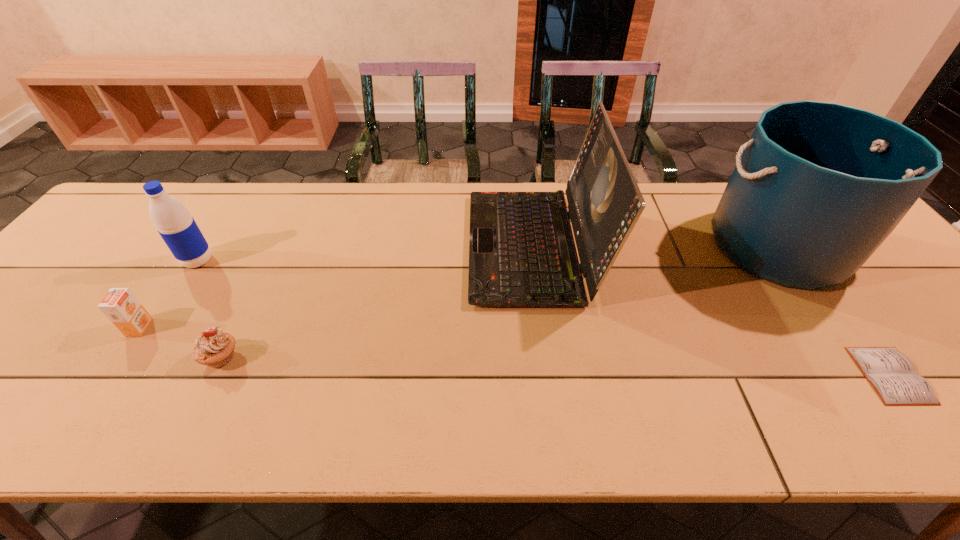
The width and height of the screenshot is (960, 540). Find the location of `free space located 0.130m on the screen of the laptop computer`. free space located 0.130m on the screen of the laptop computer is located at coordinates (422, 246).

The image size is (960, 540). What are the coordinates of `free space located on the screen of the laptop computer` in the screenshot? It's located at (419, 246).

Locate an element on the screen. This screenshot has height=540, width=960. free space located 0.250m on the right of the fourth shortest object is located at coordinates (307, 261).

This screenshot has width=960, height=540. In order to click on free region located 0.260m on the right of the fourth farthest object in this screenshot , I will do `click(260, 328)`.

Identify the location of free space located on the front of the second shortest object. (191, 418).

You are a GUI agent. You are given a task and a screenshot of the screen. Output one action in this format:
    pyautogui.click(x=<x>, y=<y>)
    Task: Click on the free region located 0.070m on the right of the diary
    The image size is (960, 540).
    Given the screenshot: What is the action you would take?
    pyautogui.click(x=949, y=375)

Locate an element on the screen. This screenshot has height=540, width=960. bucket that is at the far edge is located at coordinates (819, 186).

This screenshot has width=960, height=540. In order to click on laptop computer at the far edge in this screenshot , I will do `click(522, 253)`.

Find the location of a particular element. object present at the near edge is located at coordinates (892, 374).

Identify the location of object situated at the right edge. (819, 186).